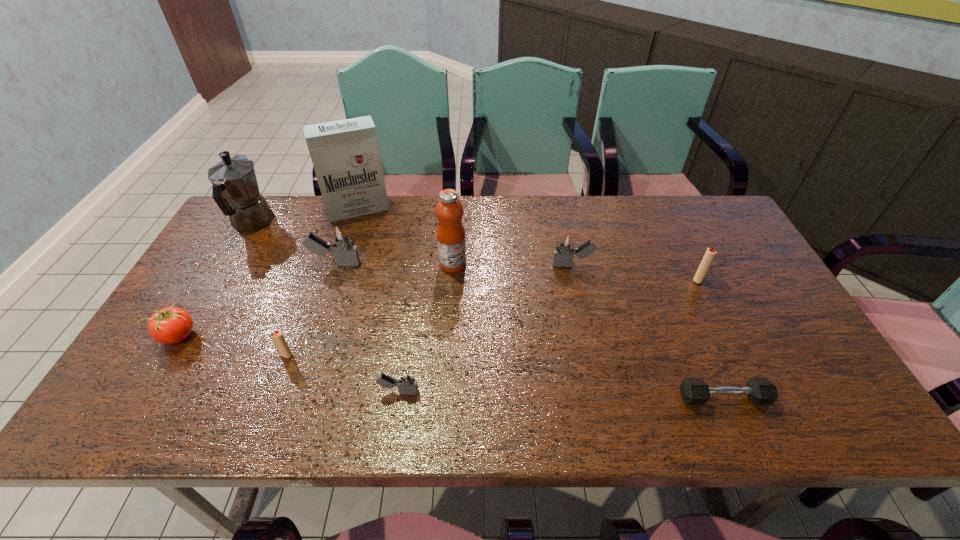
Identify the location of free space located 0.190m on the back of the sixth farthest object. The height and width of the screenshot is (540, 960). (675, 232).

I want to click on vacant area located on the left of the fourth farthest igniter, so click(x=233, y=355).

This screenshot has width=960, height=540. Find the location of `free spot located 0.090m on the right of the nearest gray igniter`. free spot located 0.090m on the right of the nearest gray igniter is located at coordinates (459, 392).

Where is `vacant space located 0.070m on the front of the red tomato`? This screenshot has height=540, width=960. vacant space located 0.070m on the front of the red tomato is located at coordinates (155, 376).

In order to click on free space located 0.220m on the back of the shortest object in this screenshot , I will do `click(686, 313)`.

Find the location of a particular element. The image size is (960, 540). cigarette case that is at the far edge is located at coordinates (345, 154).

Where is `coffeepot located at the far edge`? The image size is (960, 540). coffeepot located at the far edge is located at coordinates (235, 189).

Where is `igniter located at the near edge`? igniter located at the near edge is located at coordinates (406, 382).

Where is `dumbbell at the near edge`? dumbbell at the near edge is located at coordinates (694, 391).

Find the location of a particular element. The height and width of the screenshot is (540, 960). coffeepot that is at the left edge is located at coordinates (235, 189).